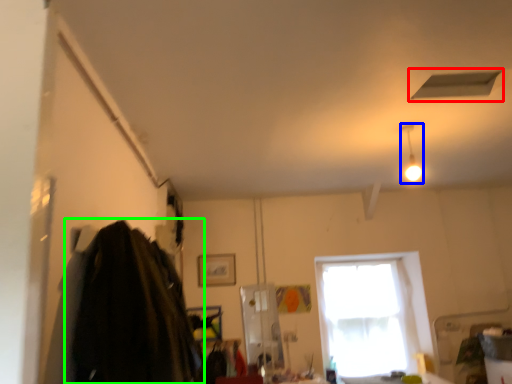
Question: Which is farther away from exhaust hood (highlighted by a red box)? light fixture (highlighted by a blue box) or clothing (highlighted by a green box)?

Choices:
 (A) light fixture
 (B) clothing

Answer: (B)